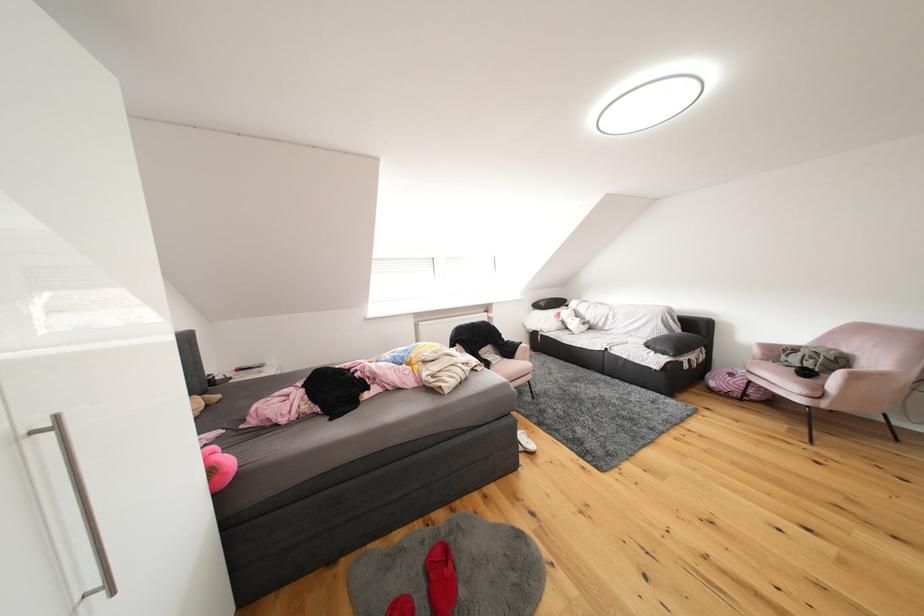
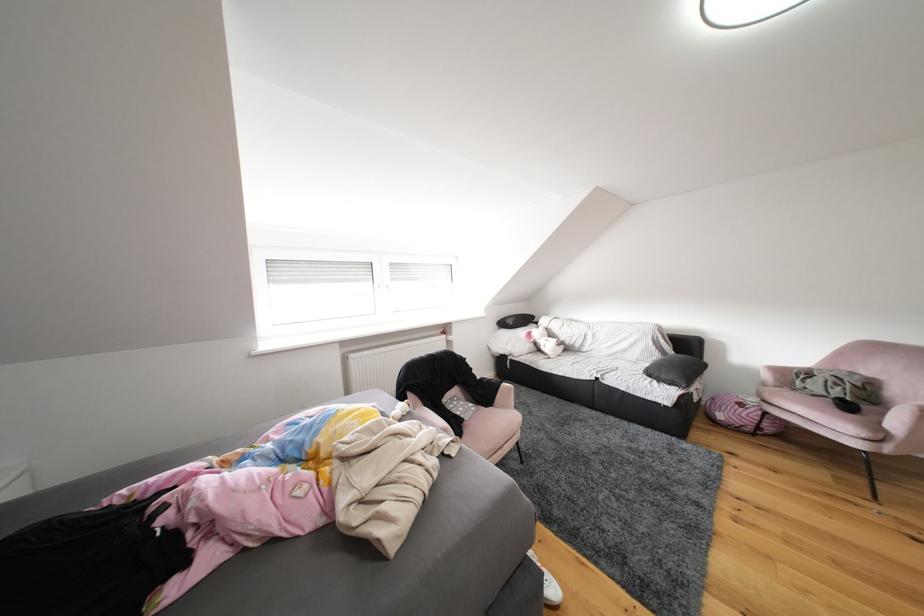
Question: The images are taken continuously from a first-person perspective. In which direction are you moving?

Choices:
 (A) Left
 (B) Right
 (C) Forward
 (D) Backward

Answer: (C)